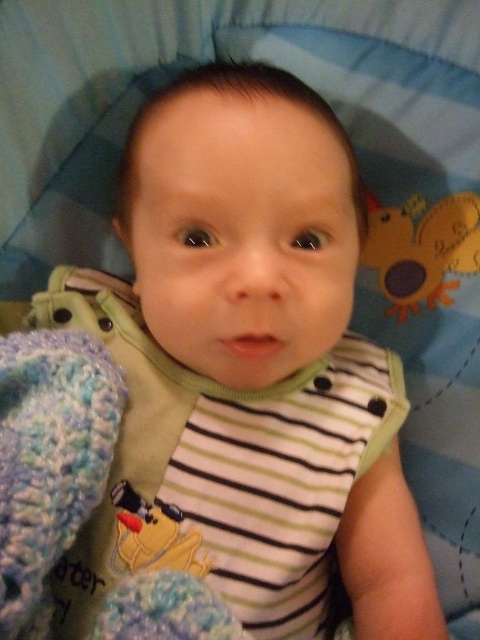
Question: Is matte yellow plush toy at upper right to the right of yellow plush duck at center from the viewer's perspective?

Choices:
 (A) no
 (B) yes

Answer: (B)

Question: Observing the image, what is the correct spatial positioning of matte yellow plush toy at upper right in reference to yellow plush duck at center?

Choices:
 (A) above
 (B) below

Answer: (A)

Question: Among these points, which one is farthest from the camera?

Choices:
 (A) (180, 552)
 (B) (368, 202)

Answer: (B)

Question: Which point is farther to the camera?

Choices:
 (A) (141, 550)
 (B) (397, 227)

Answer: (B)

Question: Can you confirm if matte yellow plush toy at upper right is thinner than yellow plush duck at center?

Choices:
 (A) no
 (B) yes

Answer: (A)

Question: Which object appears farthest from the camera in this image?

Choices:
 (A) matte yellow plush toy at upper right
 (B) yellow plush duck at center

Answer: (A)